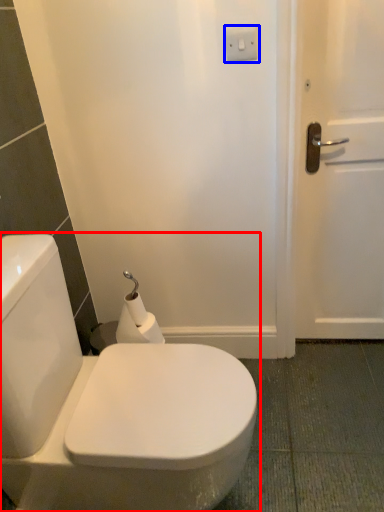
Question: Among these objects, which one is nearest to the camera, toilet (highlighted by a red box) or electric outlet (highlighted by a blue box)?

Choices:
 (A) toilet
 (B) electric outlet

Answer: (A)